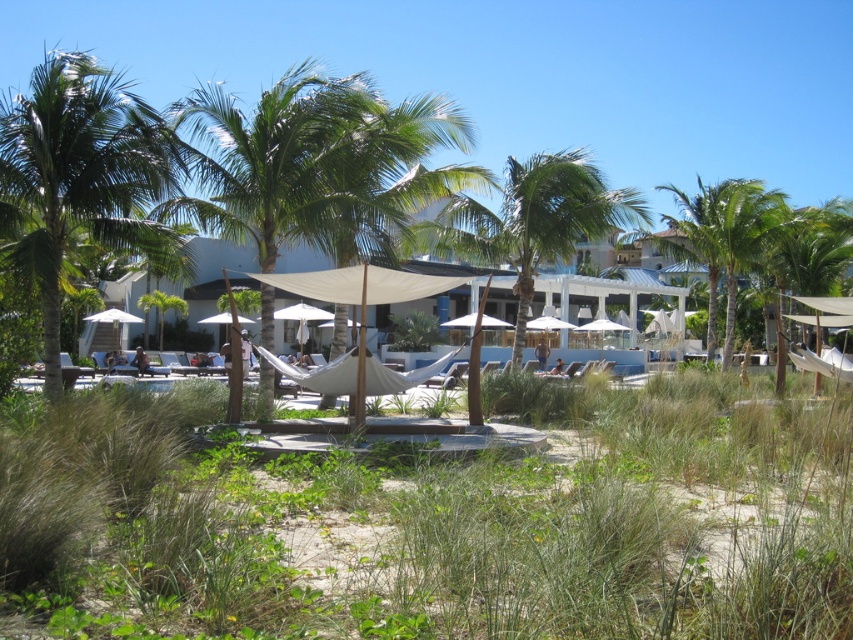
You are planning to install a new bench between the green leafy palm tree at left and the green leafy palm tree at center. The bench requires at least 30 feet of space between the two trees to be placed comfortably. Based on the scene, can the bench be installed between them?

The green leafy palm tree at left and green leafy palm tree at center are 37.07 feet apart from each other. Since 37.07 feet is more than the required 30 feet, the bench can be comfortably installed between them.

You are a guest at the resort and want to find the tallest palm tree to take a photo under. Which palm tree should you choose between the green leafy palm tree at left and the green leafy palm tree at center?

The green leafy palm tree at left is taller than the green leafy palm tree at center, so you should choose the green leafy palm tree at left for your photo.